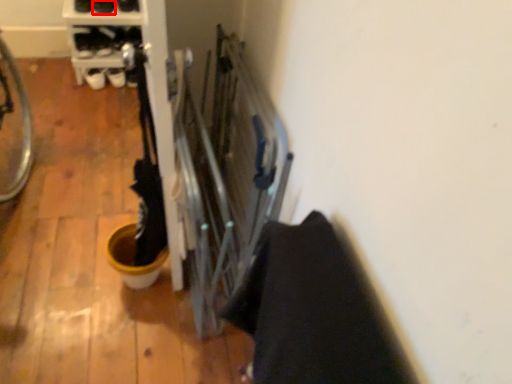
Question: From the image, what is the correct spatial relationship of footwear (annotated by the red box) in relation to footwear?

Choices:
 (A) right
 (B) left

Answer: (B)